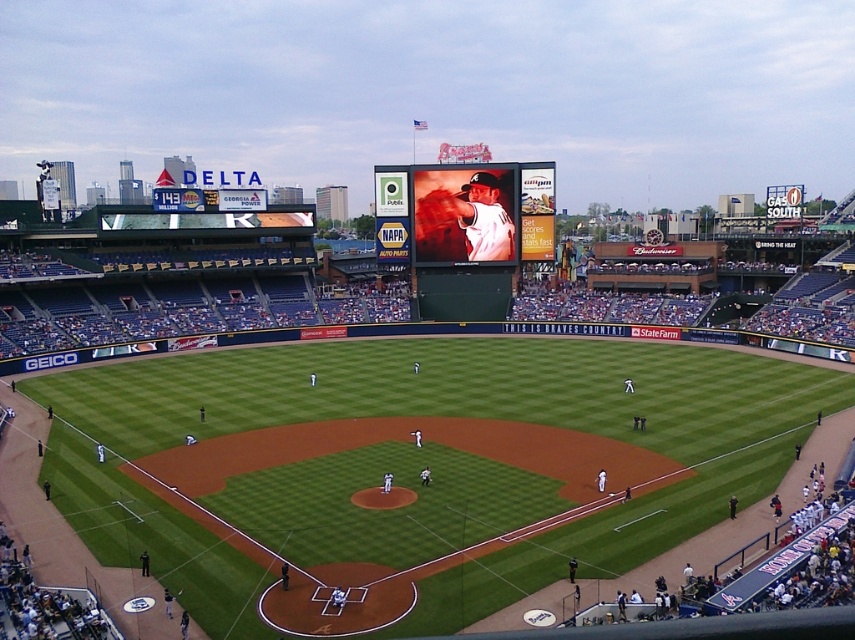
Question: Among these points, which one is nearest to the camera?

Choices:
 (A) (423, 182)
 (B) (508, 282)

Answer: (A)

Question: Does matte black scoreboard at center come behind matte white baseball player at center?

Choices:
 (A) no
 (B) yes

Answer: (A)

Question: Can you confirm if matte black scoreboard at center is thinner than matte white baseball player at center?

Choices:
 (A) yes
 (B) no

Answer: (B)

Question: Which point is closer to the camera?

Choices:
 (A) (520, 168)
 (B) (484, 179)

Answer: (B)

Question: From the image, what is the correct spatial relationship of matte black scoreboard at center in relation to matte white baseball player at center?

Choices:
 (A) right
 (B) left

Answer: (A)